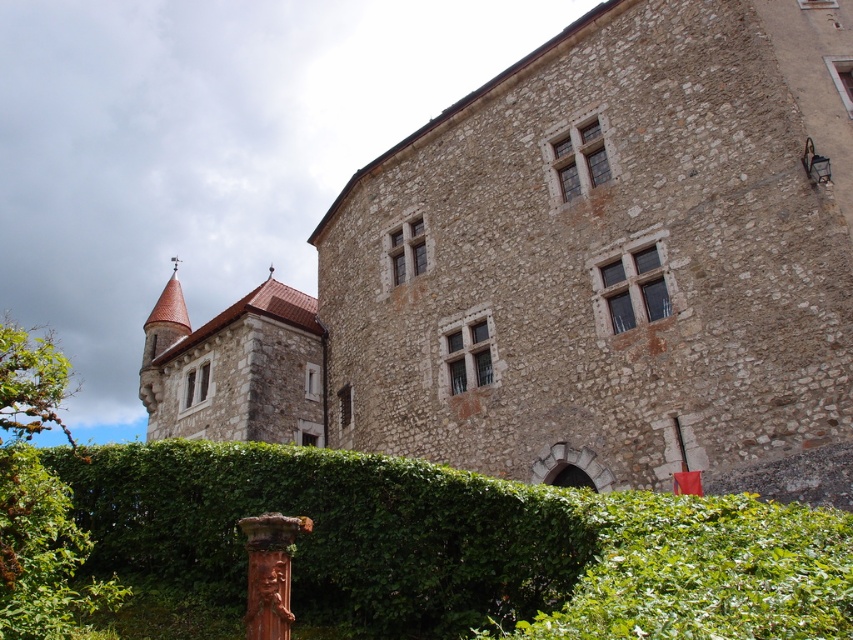
You are standing in a garden and want to take a photo of the brown stone castle at center and the green leafy hedge at lower center. Which object should you focus on first to ensure it appears sharp in the foreground?

You should focus on the brown stone castle at center first because it is closer to you than the green leafy hedge at lower center, making it the foreground element.

You are standing in a garden and see the brown stone castle at center and the green leafy hedge at lower center. Which object is located more to the left side?

The brown stone castle at center is positioned on the left side of green leafy hedge at lower center, so it is more to the left.